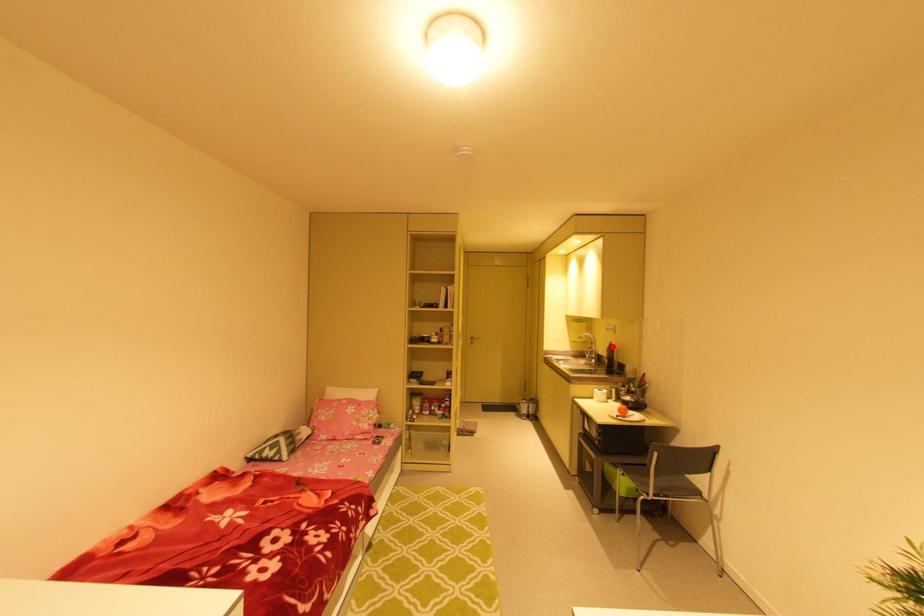
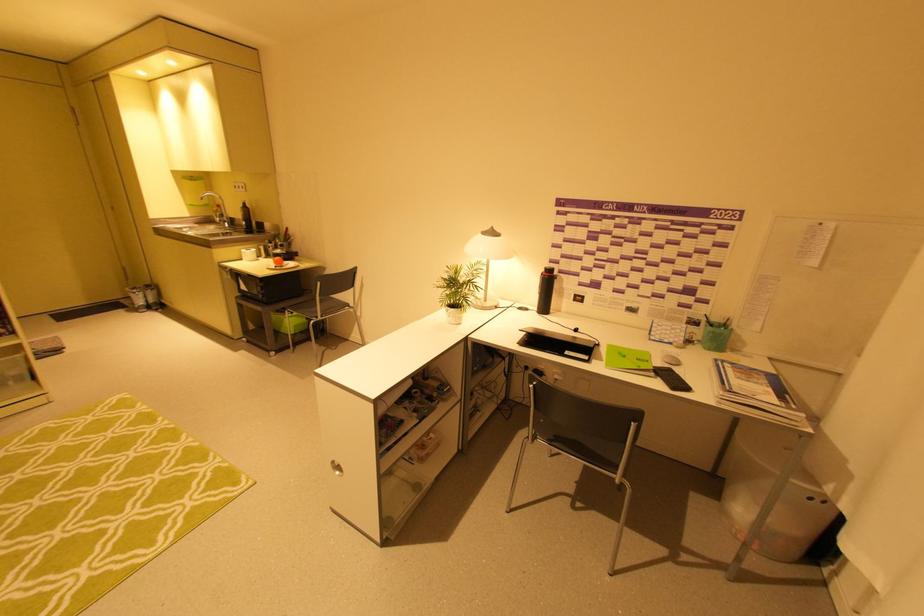
The point at the highlighted location is marked in the first image. Where is the corresponding point in the second image?

(246, 206)